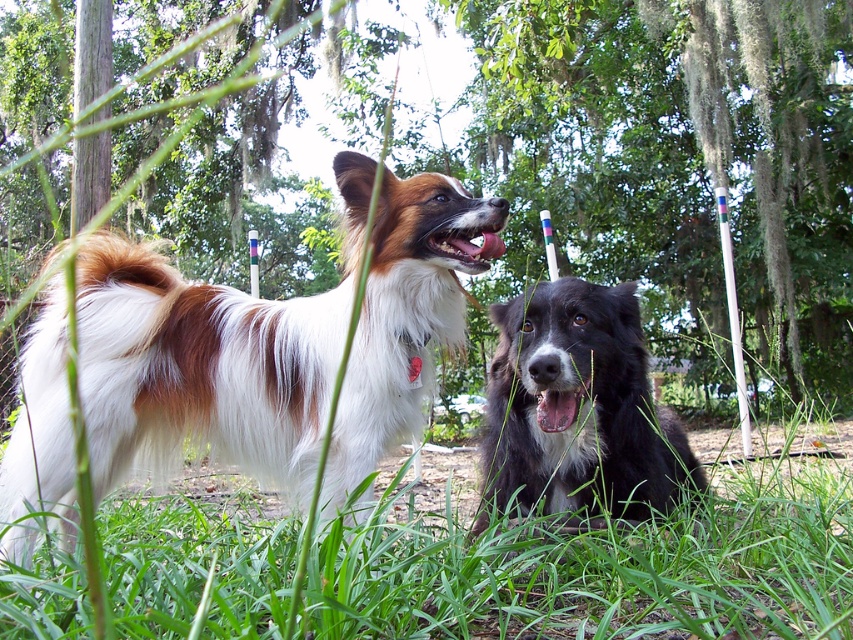
You are a photographer trying to capture a clear photo of the black fluffy dog at center without the green leafy tree at upper center blocking it. What should you do?

Move the camera downward or lower the angle to avoid the green leafy tree at upper center, which is positioned over the black fluffy dog at center.

From the picture: You are a photographer trying to capture a photo of the white and brown fur dog at left and the green leafy tree at upper center. Can you fit both subjects into the frame if you position yourself directly in front of the dog?

The green leafy tree at upper center is above the white and brown fur dog at left, so yes, you can fit both into the frame by positioning yourself in front of the dog and angling the camera upwards to include the tree above the dog.